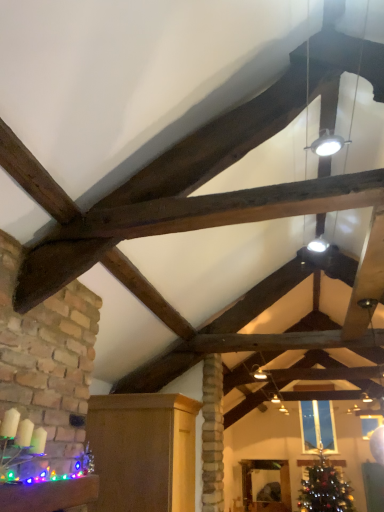
Question: Is clear glass window at center touching matte wood cabinet at lower left, which is the 2th furniture from top to bottom?

Choices:
 (A) yes
 (B) no

Answer: (B)

Question: Is clear glass window at center facing towards matte wood cabinet at lower left, the 2th furniture when ordered from right to left?

Choices:
 (A) yes
 (B) no

Answer: (A)

Question: Considering the relative positions of clear glass window at center and matte wood cabinet at lower left, which is the 2th furniture from top to bottom, in the image provided, is clear glass window at center behind matte wood cabinet at lower left, which is the 2th furniture from top to bottom,?

Choices:
 (A) no
 (B) yes

Answer: (B)

Question: Is clear glass window at center closer to camera compared to matte wood cabinet at lower left, the 2th furniture in the left-to-right sequence?

Choices:
 (A) no
 (B) yes

Answer: (A)

Question: Is clear glass window at center positioned far away from matte wood cabinet at lower left, placed as the 2th furniture when sorted from bottom to top?

Choices:
 (A) no
 (B) yes

Answer: (B)

Question: Would you say matte wood cabinet at lower left, the 2th furniture when ordered from right to left, is inside or outside clear glass window at center?

Choices:
 (A) inside
 (B) outside

Answer: (B)

Question: Looking at the image, does matte wood cabinet at lower left, which is the 2th furniture in front-to-back order, seem bigger or smaller compared to clear glass window at center?

Choices:
 (A) small
 (B) big

Answer: (B)

Question: Is matte wood cabinet at lower left, the 2th furniture in the left-to-right sequence, taller or shorter than clear glass window at center?

Choices:
 (A) short
 (B) tall

Answer: (A)

Question: Is point (89, 401) positioned closer to the camera than point (316, 429)?

Choices:
 (A) closer
 (B) farther

Answer: (A)

Question: In the image, is wooden mirror at center, acting as the first furniture starting from the bottom, positioned in front of or behind matte wood cabinet at lower left, placed as the 2th furniture when sorted from bottom to top?

Choices:
 (A) front
 (B) behind

Answer: (B)

Question: Visually, is wooden mirror at center, which appears as the 1th furniture when viewed from the right, positioned to the left or to the right of matte wood cabinet at lower left, arranged as the second furniture when viewed from the back?

Choices:
 (A) left
 (B) right

Answer: (B)

Question: From the image's perspective, is wooden mirror at center, the 1th furniture positioned from the back, located above or below matte wood cabinet at lower left, which is the 2th furniture from top to bottom?

Choices:
 (A) below
 (B) above

Answer: (A)

Question: From a real-world perspective, is wooden mirror at center, the third furniture when ordered from top to bottom, positioned above or below matte wood cabinet at lower left, arranged as the second furniture when viewed from the back?

Choices:
 (A) below
 (B) above

Answer: (A)

Question: Is shiny green christmas tree at lower right in front of or behind matte wood cabinet at lower left, the 2th furniture when ordered from right to left, in the image?

Choices:
 (A) behind
 (B) front

Answer: (A)

Question: Is shiny green christmas tree at lower right taller or shorter than matte wood cabinet at lower left, which is the 2th furniture from top to bottom?

Choices:
 (A) tall
 (B) short

Answer: (A)